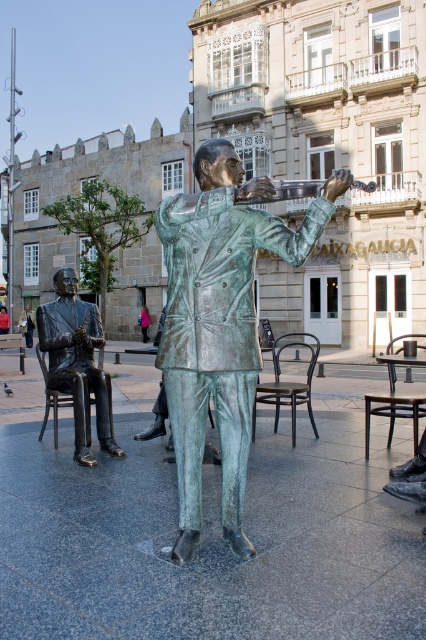
Question: Can you confirm if green patina statue at center is positioned above bronze statue at left?

Choices:
 (A) yes
 (B) no

Answer: (A)

Question: Which point is farther to the camera?

Choices:
 (A) (68, 272)
 (B) (172, 204)

Answer: (A)

Question: Which object is farther from the camera taking this photo?

Choices:
 (A) green patina statue at center
 (B) bronze statue at left

Answer: (B)

Question: Can you confirm if green patina statue at center is positioned below bronze statue at left?

Choices:
 (A) no
 (B) yes

Answer: (A)

Question: Is green patina statue at center thinner than bronze statue at left?

Choices:
 (A) no
 (B) yes

Answer: (A)